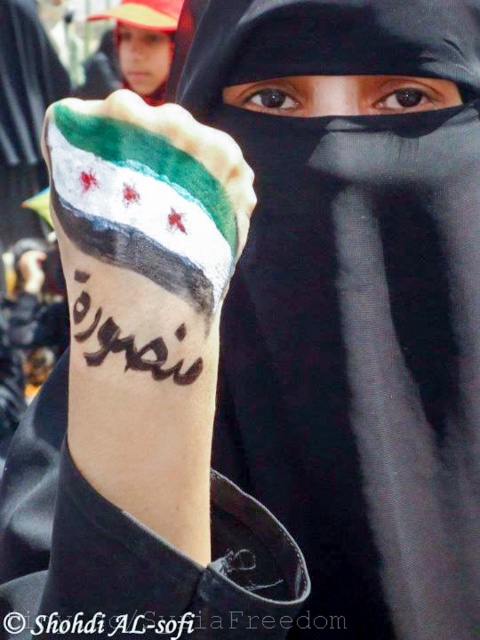
Looking at the scene, where is the black ink writing at center in relation to the smooth skin face at upper left?

The black ink writing at center is to the right of the smooth skin face at upper left.

You are a photographer trying to capture a close shot of the black matte niqab at center. Your camera has a minimum focusing distance of 30 inches. Can you take the photo without moving closer?

The black matte niqab at center and camera are 28.36 inches apart from each other. Since the minimum focusing distance is 30 inches, the camera cannot focus properly. You need to move back to at least 30 inches away to take the photo.

You are a journalist documenting a protest. You notice the black ink writing at center and the smooth skin face at upper left in the image. Which object is closer to the camera?

The black ink writing at center is closer to the camera because it is in front of the smooth skin face at upper left.